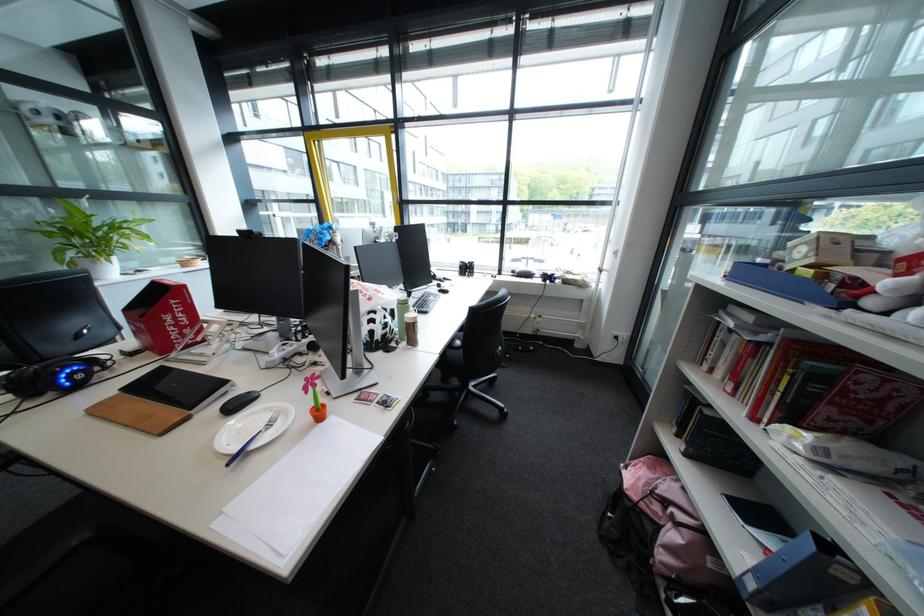
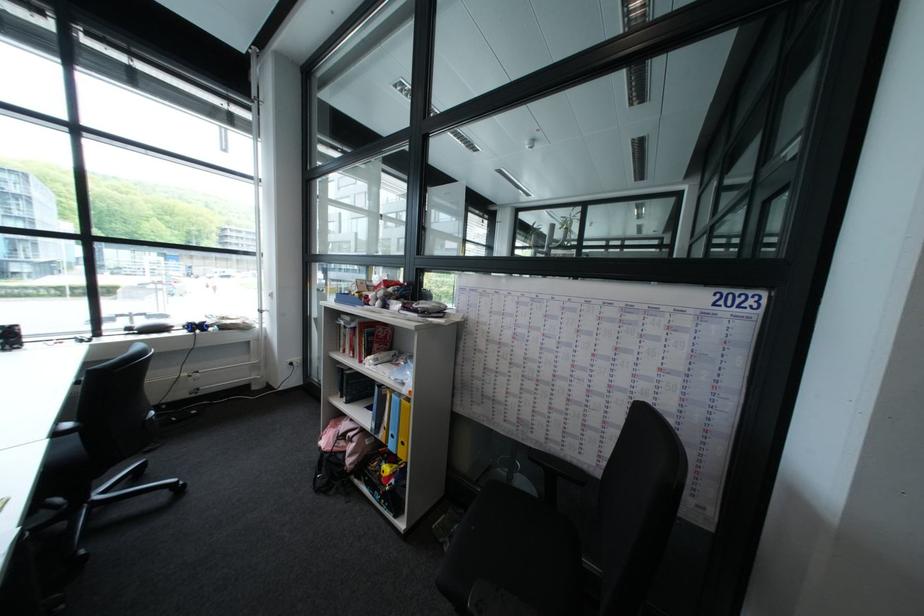
Locate, in the second image, the point that corresponds to point (759, 273) in the first image.

(358, 299)